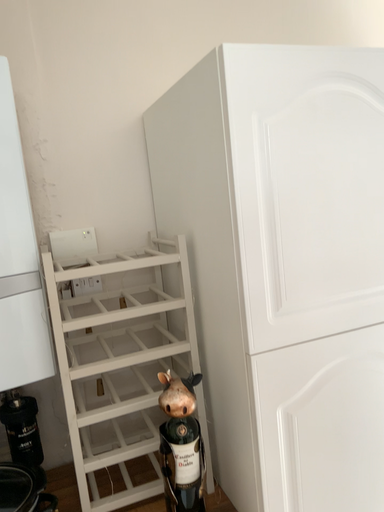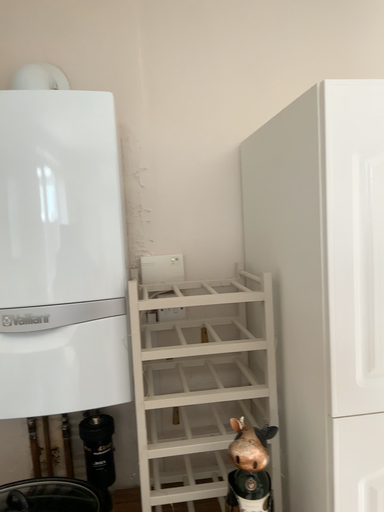
Question: Which way did the camera rotate in the video?

Choices:
 (A) rotated right
 (B) rotated left

Answer: (B)